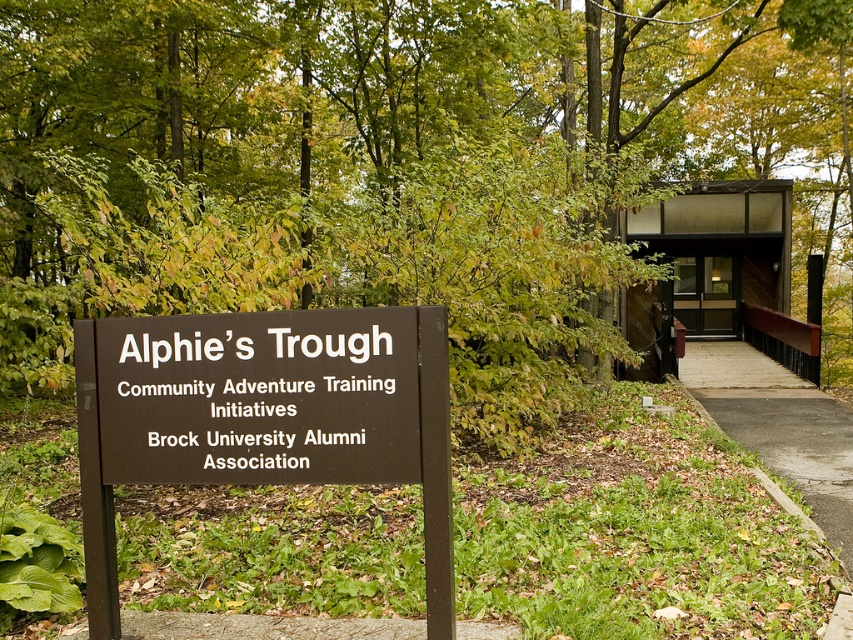
Consider the image. What are the coordinates of the brown matte sign at center?

The coordinates of the brown matte sign at center are (264,417).

You are standing at the entrance of the facility and see the brown matte sign at center and the asphalt pavement at center. Which object is positioned to the left when facing the sign?

The brown matte sign at center is to the left of the asphalt pavement at center.